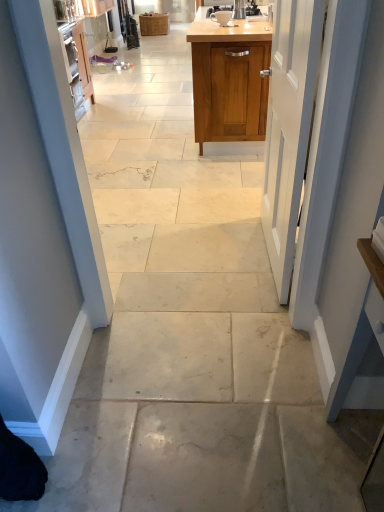
Question: From the image's perspective, is white painted wood door at center above or below wooden cabinet at upper center, the first cabinetry positioned from the bottom?

Choices:
 (A) above
 (B) below

Answer: (B)

Question: Considering the positions of point (263, 181) and point (213, 70), is point (263, 181) closer or farther from the camera than point (213, 70)?

Choices:
 (A) closer
 (B) farther

Answer: (A)

Question: Which is nearer to the wooden cabinet at upper center, arranged as the 1th cabinetry when viewed from the right?

Choices:
 (A) matte ceramic coffee cup at upper center
 (B) white painted wood door at center
 (C) wooden cabinet at center, the second cabinetry in the bottom-to-top sequence

Answer: (A)

Question: Which of these objects is positioned closest to the white painted wood door at center?

Choices:
 (A) wooden cabinet at center, the second cabinetry in the bottom-to-top sequence
 (B) matte ceramic coffee cup at upper center
 (C) wooden cabinet at upper center, acting as the first cabinetry starting from the front

Answer: (C)